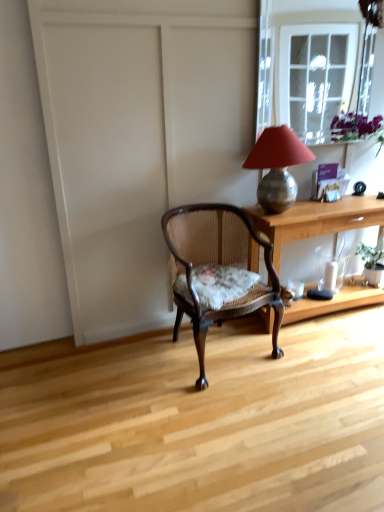
Describe the element at coordinates (341, 272) in the screenshot. I see `transparent glass vase at lower right` at that location.

The height and width of the screenshot is (512, 384). I want to click on clear glass window at upper right, so [x=290, y=52].

Measure the distance between green leafy plant at right and camera.

The distance of green leafy plant at right from camera is 2.95 meters.

Where is `green leafy plant at right`? The image size is (384, 512). green leafy plant at right is located at coordinates (371, 264).

I want to click on metallic lampshade at upper right, so click(277, 166).

Does point (338, 226) lie in front of point (186, 311)?

No, it is not.

Between wooden desk at center and wooden cane chair with floral cushion at center, which one has smaller size?

With smaller size is wooden cane chair with floral cushion at center.

Which of these two, wooden desk at center or wooden cane chair with floral cushion at center, stands taller?

wooden cane chair with floral cushion at center.

Is wooden cane chair with floral cushion at center located within wooden desk at center?

That's incorrect, wooden cane chair with floral cushion at center is not inside wooden desk at center.

How distant is clear glass window at upper right from transparent glass vase at lower right?

A distance of 7.54 feet exists between clear glass window at upper right and transparent glass vase at lower right.

Considering the relative positions of clear glass window at upper right and transparent glass vase at lower right in the image provided, is clear glass window at upper right to the left or to the right of transparent glass vase at lower right?

clear glass window at upper right is to the left of transparent glass vase at lower right.

From the image's perspective, relative to transparent glass vase at lower right, is clear glass window at upper right above or below?

clear glass window at upper right is above transparent glass vase at lower right.

Is clear glass window at upper right positioned beyond the bounds of transparent glass vase at lower right?

Yes, clear glass window at upper right is not within transparent glass vase at lower right.

In terms of height, does wooden desk at center look taller or shorter compared to clear glass window at upper right?

In the image, wooden desk at center appears to be shorter than clear glass window at upper right.

Is wooden desk at center completely or partially outside of clear glass window at upper right?

Yes.

From the image's perspective, does wooden desk at center appear higher than clear glass window at upper right?

No, from the image's perspective, wooden desk at center is not above clear glass window at upper right.

In terms of width, does wooden desk at center look wider or thinner when compared to clear glass window at upper right?

Clearly, wooden desk at center has more width compared to clear glass window at upper right.

How different are the orientations of transparent glass vase at lower right and wooden cane chair with floral cushion at center in degrees?

10.4 degrees.

Can you confirm if transparent glass vase at lower right is wider than wooden cane chair with floral cushion at center?

No, transparent glass vase at lower right is not wider than wooden cane chair with floral cushion at center.

In terms of height, does transparent glass vase at lower right look taller or shorter compared to wooden cane chair with floral cushion at center?

In the image, transparent glass vase at lower right appears to be shorter than wooden cane chair with floral cushion at center.

How much distance is there between wooden desk at center and metallic lampshade at upper right?

A distance of 23.90 centimeters exists between wooden desk at center and metallic lampshade at upper right.

Is wooden desk at center completely or partially outside of metallic lampshade at upper right?

Yes, wooden desk at center is not within metallic lampshade at upper right.

Is wooden desk at center turned away from metallic lampshade at upper right?

That's not correct — wooden desk at center is not looking away from metallic lampshade at upper right.

From the image's perspective, which is below, wooden desk at center or metallic lampshade at upper right?

wooden desk at center, from the image's perspective.

Is metallic lampshade at upper right taller or shorter than wooden desk at center?

In the image, metallic lampshade at upper right appears to be shorter than wooden desk at center.

Which object is further away from the camera, metallic lampshade at upper right or wooden desk at center?

wooden desk at center is behind.

From the image's perspective, which one is positioned higher, metallic lampshade at upper right or wooden desk at center?

metallic lampshade at upper right appears higher in the image.

In order to click on desk below the metallic lampshade at upper right (from the image's perspective) in this screenshot , I will do `click(316, 220)`.

Does point (274, 147) appear closer or farther from the camera than point (261, 283)?

Clearly, point (274, 147) is closer to the camera than point (261, 283).

Find the location of a particular element. This screenshot has width=384, height=512. lamp above the wooden cane chair with floral cushion at center (from a real-world perspective) is located at coordinates (277, 166).

Could you tell me if metallic lampshade at upper right is turned towards wooden cane chair with floral cushion at center?

No.

Which is more to the right, metallic lampshade at upper right or wooden cane chair with floral cushion at center?

From the viewer's perspective, metallic lampshade at upper right appears more on the right side.

At what (x,y) coordinates should I click in order to perform the action: click on chair that appears below the wooden desk at center (from the image's perspective). Please return your answer as a coordinate pair (x, y). This screenshot has width=384, height=512. Looking at the image, I should click on (215, 264).

The image size is (384, 512). Identify the location of glass vase located behind the clear glass window at upper right. (341, 272).

When comparing their distances from metallic lampshade at upper right, does wooden desk at center or transparent glass vase at lower right seem further?

transparent glass vase at lower right lies further to metallic lampshade at upper right than the other object.

Looking at the image, which one is located closer to transparent glass vase at lower right, green leafy plant at right or wooden cane chair with floral cushion at center?

Based on the image, green leafy plant at right appears to be nearer to transparent glass vase at lower right.

When comparing their distances from green leafy plant at right, does metallic lampshade at upper right or wooden cane chair with floral cushion at center seem closer?

The object closer to green leafy plant at right is metallic lampshade at upper right.

Which object lies nearer to the anchor point wooden desk at center, green leafy plant at right or wooden cane chair with floral cushion at center?

Based on the image, wooden cane chair with floral cushion at center appears to be nearer to wooden desk at center.

Which object lies nearer to the anchor point wooden desk at center, wooden cane chair with floral cushion at center or green leafy plant at right?

wooden cane chair with floral cushion at center lies closer to wooden desk at center than the other object.

Estimate the real-world distances between objects in this image. Which object is further from clear glass window at upper right, transparent glass vase at lower right or green leafy plant at right?

The object further to clear glass window at upper right is transparent glass vase at lower right.

Which object lies nearer to the anchor point clear glass window at upper right, wooden desk at center or metallic lampshade at upper right?

metallic lampshade at upper right.

Estimate the real-world distances between objects in this image. Which object is closer to clear glass window at upper right, green leafy plant at right or wooden cane chair with floral cushion at center?

green leafy plant at right is positioned closer to the anchor clear glass window at upper right.

This screenshot has height=512, width=384. What are the coordinates of `houseplant between clear glass window at upper right and transparent glass vase at lower right in the up-down direction` in the screenshot? It's located at (371, 264).

What are the coordinates of `glass vase located between wooden desk at center and green leafy plant at right in the depth direction` in the screenshot? It's located at (341, 272).

Image resolution: width=384 pixels, height=512 pixels. What are the coordinates of `desk that lies between clear glass window at upper right and wooden cane chair with floral cushion at center from top to bottom` in the screenshot? It's located at (316, 220).

Locate an element on the screen. This screenshot has height=512, width=384. lamp between clear glass window at upper right and wooden desk at center in the up-down direction is located at coordinates (277, 166).